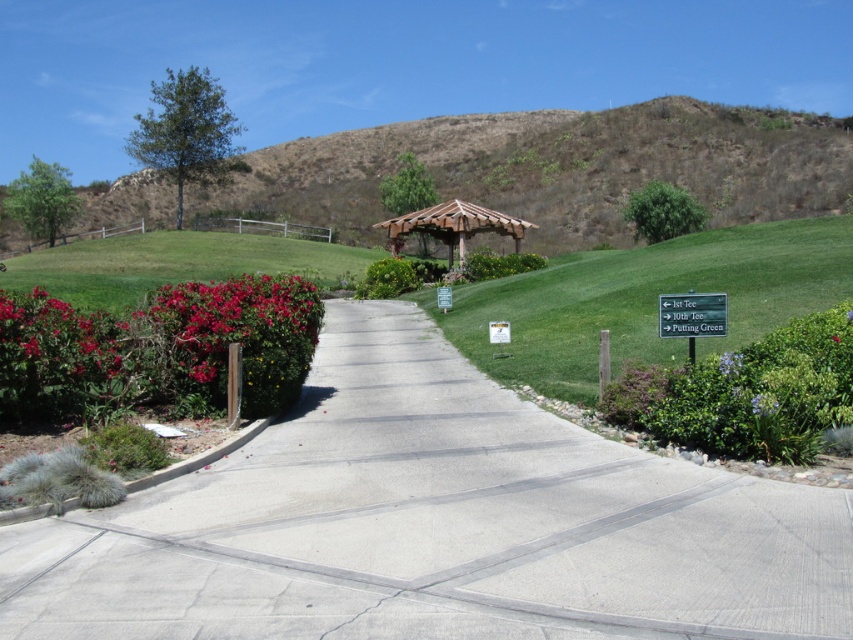
You are standing at the viewpoint of the image and see two points marked on the pathway. Which point, point [190,362] or point [457,227], is closer to you?

Point [190,362] is closer to the viewer than point [457,227].

Consider the image. You are a gardener who needs to plant a new flower bed. You have a small flower that requires a space of 1 square meter. Based on the image, can the purple matte flower at lower right accommodate this new flower bed without overlapping with the green grass at center?

The purple matte flower at lower right has a smaller area than the green grass at center. Since the new flower bed requires 1 square meter, it depends on whether the purple matte flower area is at least 1 square meter. However, since the description only states it is smaller than the grass, we cannot confirm without exact measurements.

Consider the image. You are standing at the center of the paved pathway and want to pick the glossy red flowers at left. In which direction should you move to reach them?

The glossy red flowers at left are located to your left side, so you should move to your left to reach them.